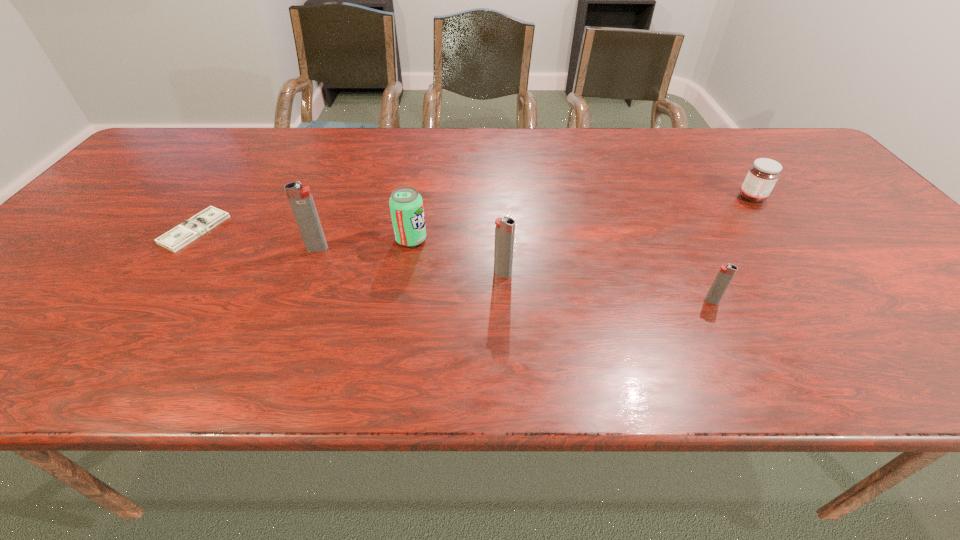
Find the location of a particular element. The width and height of the screenshot is (960, 540). free spot that satisfies the following two spatial constraints: 1. on the front side of the shortest object; 2. on the right side of the fifth object from right to left is located at coordinates (180, 248).